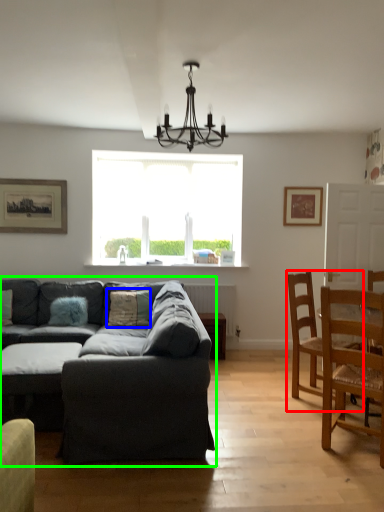
Question: Considering the real-world distances, which object is closest to chair (highlighted by a red box)? pillow (highlighted by a blue box) or studio couch (highlighted by a green box).

Choices:
 (A) pillow
 (B) studio couch

Answer: (B)